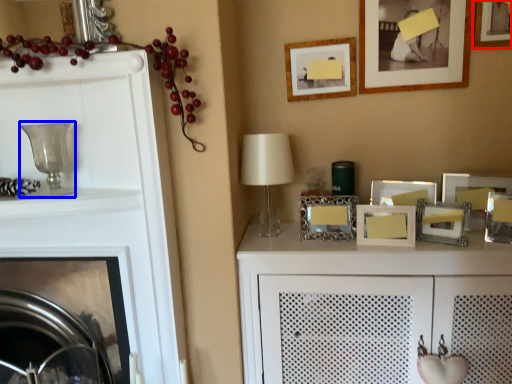
Question: Which point is further to the camera, picture frame (highlighted by a red box) or candle holder (highlighted by a blue box)?

Choices:
 (A) picture frame
 (B) candle holder

Answer: (A)